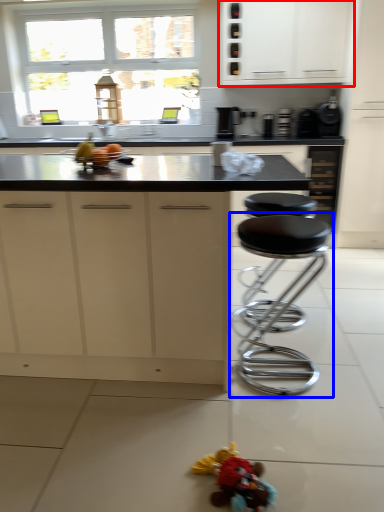
Question: Which of the following is the closest to the observer, cabinetry (highlighted by a red box) or stool (highlighted by a blue box)?

Choices:
 (A) cabinetry
 (B) stool

Answer: (B)